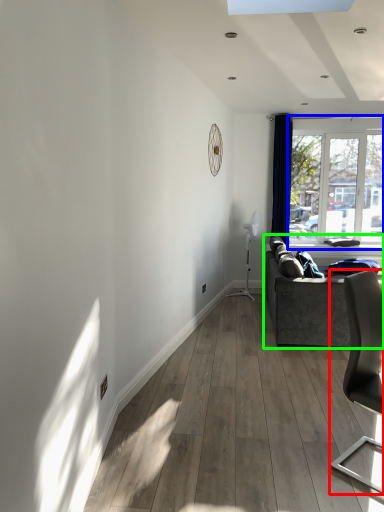
Question: Estimate the real-world distances between objects in this image. Which object is closer to chair (highlighted by a red box), window (highlighted by a blue box) or studio couch (highlighted by a green box)?

Choices:
 (A) window
 (B) studio couch

Answer: (B)